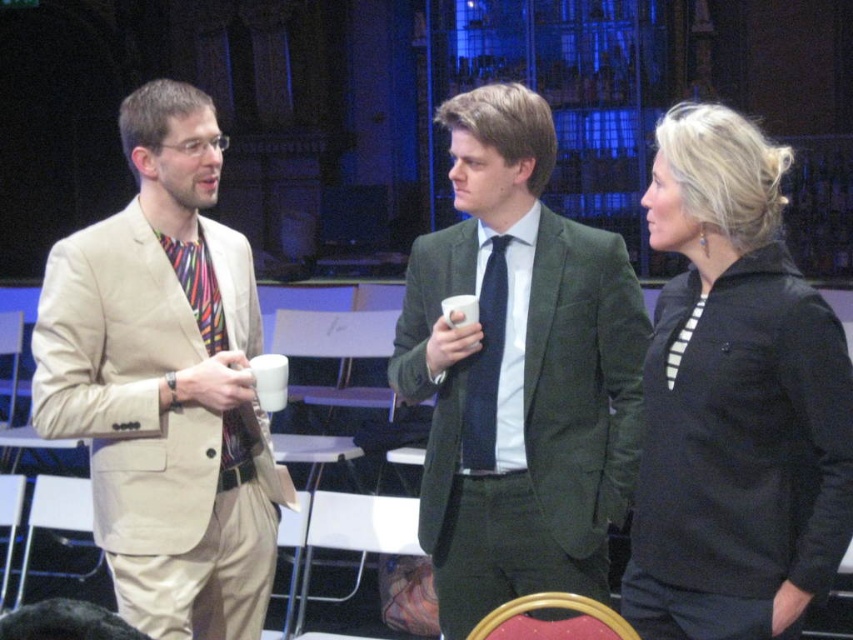
What are the coordinates of the black matte jacket at center?

The coordinates of the black matte jacket at center are 0.628 in the x direction and 0.863 in the y direction.

In the scene shown: You are a photographer at the event and need to ensure that both the beige cotton suit at left and the multicolored fabric tie at left are visible in your photo. Given their sizes, which one might require you to adjust your camera angle to capture fully?

The beige cotton suit at left is larger in size than the multicolored fabric tie at left, so the beige cotton suit at left may require adjusting the camera angle to ensure it is fully captured in the photo.